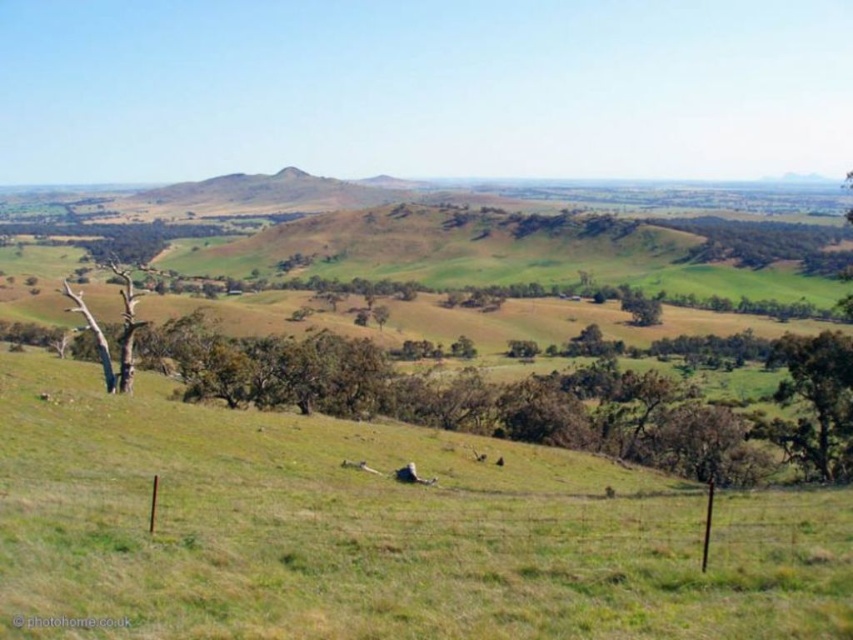
Question: Does green leafy tree at lower right have a smaller size compared to dead wood tree at left?

Choices:
 (A) yes
 (B) no

Answer: (A)

Question: Which point is closer to the camera?

Choices:
 (A) dead wood tree at left
 (B) green leafy tree at lower right

Answer: (B)

Question: Is green leafy tree at lower right further to camera compared to dead wood tree at left?

Choices:
 (A) no
 (B) yes

Answer: (A)

Question: Can you confirm if green leafy tree at lower right is thinner than dead wood tree at left?

Choices:
 (A) yes
 (B) no

Answer: (A)